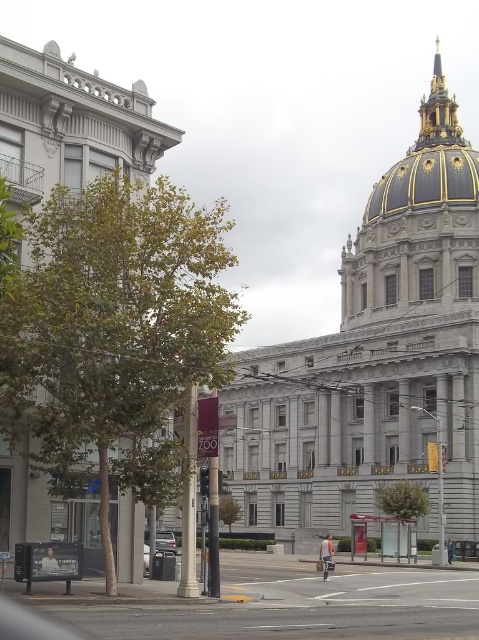
You are a tourist standing at the entrance of San Francisco City Hall. You see two points marked on the ground in front of you. The first point is located at coordinates point (442, 72) and the second at point (422, 131). Which point is closer to you?

Point (422, 131) is closer to you because it is in front of point (442, 72).

You are standing at the point marked by the coordinates point (430,161) in the image. What architectural feature are you directly facing?

You are directly facing the gold gilded dome at upper right, as the coordinates point (430,161) corresponds to this feature.